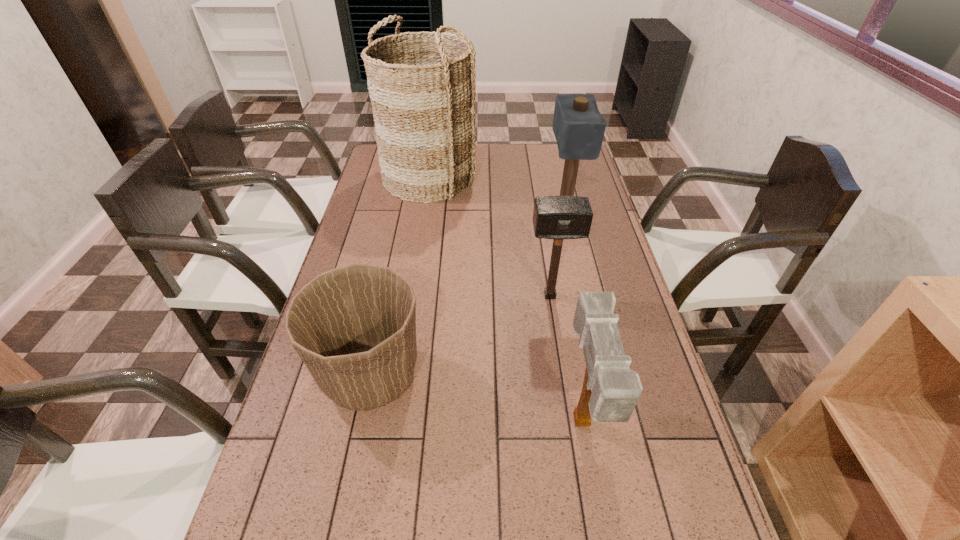
At what (x,y) coordinates should I click in order to perform the action: click on the third closest mallet to the tallest object. Please return your answer as a coordinate pair (x, y). Looking at the image, I should click on (610, 392).